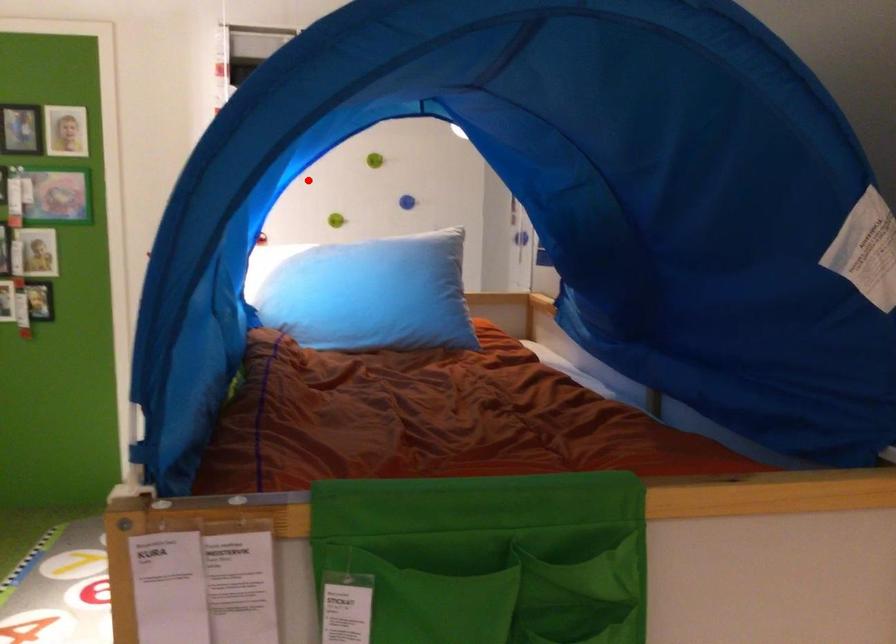
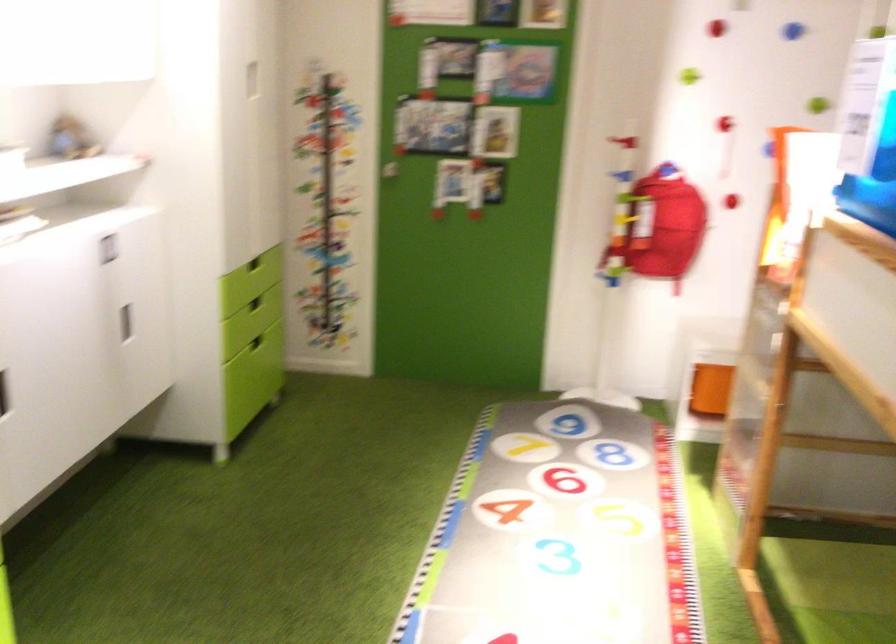
Find the pixel in the second image that matches the highlighted location in the first image.

(793, 31)